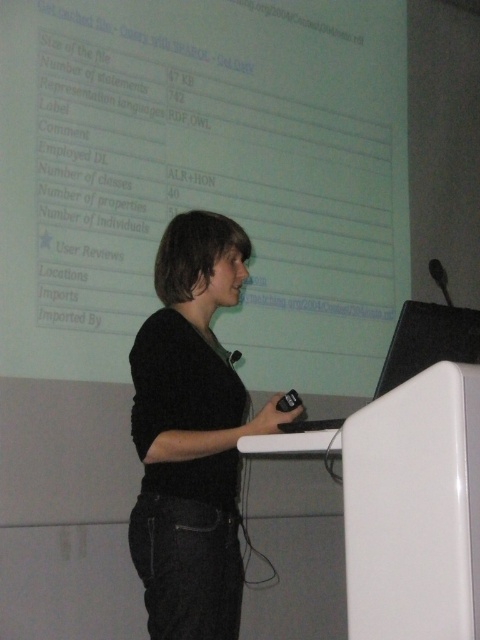
Can you confirm if white matte projection screen at upper center is positioned to the left of black fuzzy sweater at center?

Incorrect, white matte projection screen at upper center is not on the left side of black fuzzy sweater at center.

Does white matte projection screen at upper center lie in front of black fuzzy sweater at center?

No, white matte projection screen at upper center is further to the viewer.

Is point (372, 19) closer to camera compared to point (177, 369)?

No, it is behind (177, 369).

Where is `white matte projection screen at upper center`? The height and width of the screenshot is (640, 480). white matte projection screen at upper center is located at coordinates (204, 177).